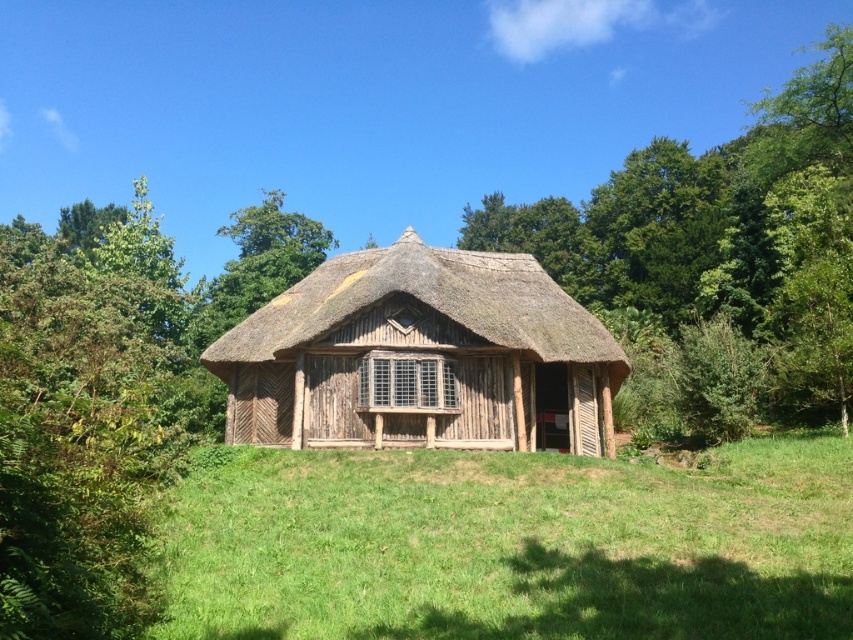
Between green grass at center and thatched straw roof at center, which one appears on the left side from the viewer's perspective?

thatched straw roof at center is more to the left.

Is green grass at center above thatched straw roof at center?

No, green grass at center is not above thatched straw roof at center.

Which is in front, point (747, 465) or point (326, 284)?

Point (747, 465) is more forward.

The width and height of the screenshot is (853, 640). Identify the location of green grass at center. (511, 545).